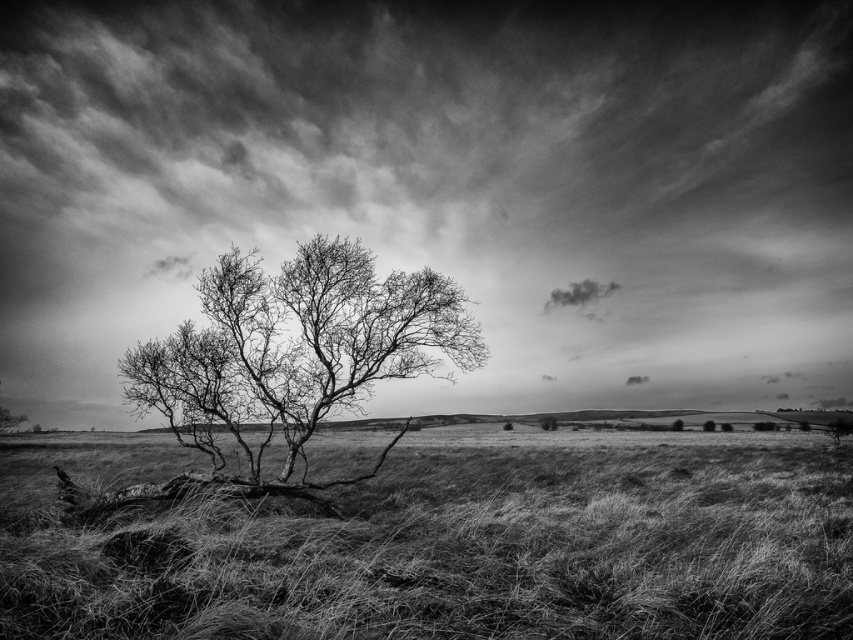
Question: Does bare branches at center have a greater width compared to fuzzy white cloud at upper center?

Choices:
 (A) no
 (B) yes

Answer: (B)

Question: Can you confirm if cloudy sky at upper center is positioned to the right of fuzzy white cloud at upper center?

Choices:
 (A) yes
 (B) no

Answer: (B)

Question: In this image, where is cloudy sky at upper center located relative to bare branches at center?

Choices:
 (A) right
 (B) left

Answer: (A)

Question: Which point is closer to the camera?

Choices:
 (A) bare branches at center
 (B) fuzzy white cloud at upper center
 (C) cloudy sky at upper center
 (D) fuzzy grass at lower left

Answer: (D)

Question: Which point is closer to the camera taking this photo?

Choices:
 (A) (704, 483)
 (B) (107, 360)
 (C) (120, 364)

Answer: (C)

Question: Which point appears closest to the camera in this image?

Choices:
 (A) (281, 358)
 (B) (194, 234)

Answer: (A)